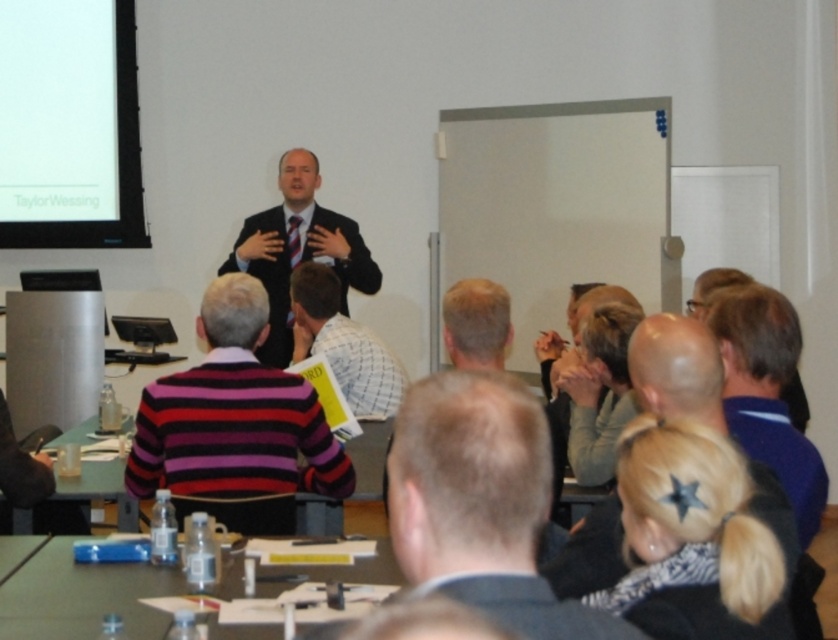
Is dark blue shirt at right taller than clear plastic table at lower left?

Correct, dark blue shirt at right is much taller as clear plastic table at lower left.

How much distance is there between dark blue shirt at right and clear plastic table at lower left?

dark blue shirt at right and clear plastic table at lower left are 2.36 meters apart.

Between point (742, 276) and point (30, 550), which one is positioned in front?

Point (30, 550) is more forward.

Where is `dark blue shirt at right`? The width and height of the screenshot is (838, 640). dark blue shirt at right is located at coordinates coord(712,285).

In the scene shown: Which of these two, blonde hair at lower right or blue shirt at lower right, stands taller?

Standing taller between the two is blue shirt at lower right.

Does blonde hair at lower right have a larger size compared to blue shirt at lower right?

Actually, blonde hair at lower right might be smaller than blue shirt at lower right.

Where is `blonde hair at lower right`? blonde hair at lower right is located at coordinates (697, 538).

Image resolution: width=838 pixels, height=640 pixels. Find the location of `blonde hair at lower right`. blonde hair at lower right is located at coordinates pyautogui.click(x=697, y=538).

Is point (542, 604) closer to viewer compared to point (8, 564)?

Yes, point (542, 604) is closer to viewer.

Which is more to the right, light brown hair at center or clear plastic table at lower left?

light brown hair at center is more to the right.

I want to click on light brown hair at center, so click(480, 502).

Where is `light brown hair at center`? The image size is (838, 640). light brown hair at center is located at coordinates 480,502.